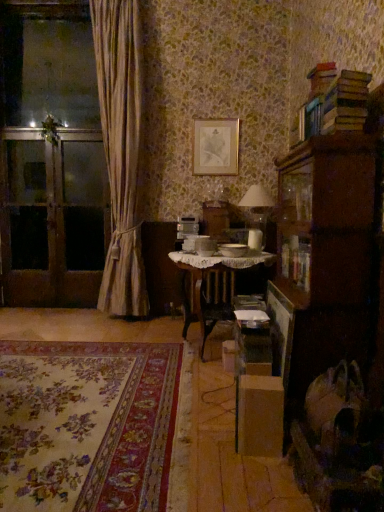
Question: From a real-world perspective, is brown wooden screen door at left, positioned as the 3th screen door in right-to-left order, on floral carpet at lower left?

Choices:
 (A) yes
 (B) no

Answer: (A)

Question: From a real-world perspective, is brown wooden screen door at left, positioned as the 3th screen door in right-to-left order, positioned under floral carpet at lower left based on gravity?

Choices:
 (A) yes
 (B) no

Answer: (B)

Question: From the image's perspective, does brown wooden screen door at left, the 1th screen door from the left, appear higher than floral carpet at lower left?

Choices:
 (A) no
 (B) yes

Answer: (B)

Question: Can you confirm if brown wooden screen door at left, positioned as the 3th screen door in right-to-left order, is smaller than floral carpet at lower left?

Choices:
 (A) no
 (B) yes

Answer: (B)

Question: Does brown wooden screen door at left, positioned as the 3th screen door in right-to-left order, appear on the right side of floral carpet at lower left?

Choices:
 (A) yes
 (B) no

Answer: (B)

Question: Is silky beige curtain at left inside or outside of white lace-covered table at center?

Choices:
 (A) inside
 (B) outside

Answer: (B)

Question: In terms of width, does silky beige curtain at left look wider or thinner when compared to white lace-covered table at center?

Choices:
 (A) wide
 (B) thin

Answer: (B)

Question: Is silky beige curtain at left in front of or behind white lace-covered table at center in the image?

Choices:
 (A) behind
 (B) front

Answer: (A)

Question: From the image's perspective, is silky beige curtain at left located above or below white lace-covered table at center?

Choices:
 (A) below
 (B) above

Answer: (B)

Question: Relative to hardcover books at upper right, is gold metallic picture frame at upper center in front or behind?

Choices:
 (A) front
 (B) behind

Answer: (B)

Question: From the image's perspective, is gold metallic picture frame at upper center positioned above or below hardcover books at upper right?

Choices:
 (A) below
 (B) above

Answer: (B)

Question: Is point (223, 133) closer or farther from the camera than point (342, 72)?

Choices:
 (A) closer
 (B) farther

Answer: (B)

Question: Would you say gold metallic picture frame at upper center is to the left or to the right of hardcover books at upper right in the picture?

Choices:
 (A) right
 (B) left

Answer: (B)

Question: Is white matte table lamp at center situated inside hardcover books at upper right or outside?

Choices:
 (A) inside
 (B) outside

Answer: (B)

Question: Considering the positions of point (256, 208) and point (334, 91), is point (256, 208) closer or farther from the camera than point (334, 91)?

Choices:
 (A) farther
 (B) closer

Answer: (A)